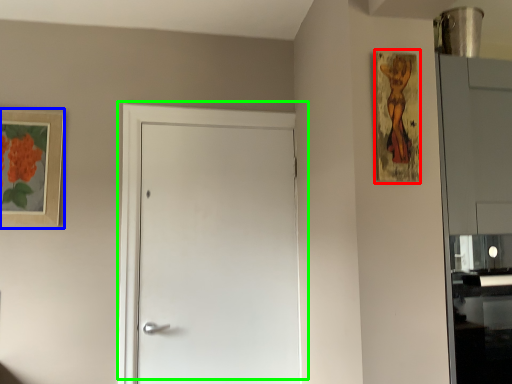
Question: Which object is the closest to the picture frame (highlighted by a red box)? Choose among these: picture frame (highlighted by a blue box) or door (highlighted by a green box).

Choices:
 (A) picture frame
 (B) door

Answer: (B)